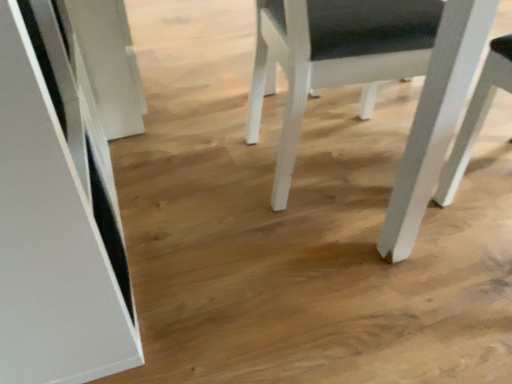
Question: Should I look upward or downward to see white matte chair at upper right?

Choices:
 (A) up
 (B) down

Answer: (A)